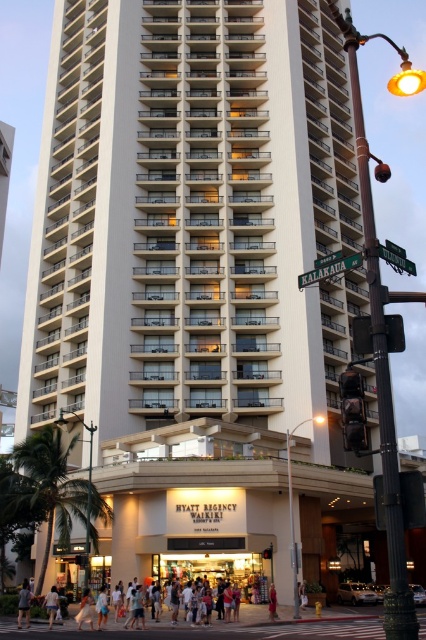
Which is in front, point (49, 612) or point (273, 605)?

Point (49, 612) is in front.

Can you confirm if light blue denim shorts at lower center is shorter than red fabric dress at lower center?

In fact, light blue denim shorts at lower center may be taller than red fabric dress at lower center.

The height and width of the screenshot is (640, 426). What are the coordinates of `light blue denim shorts at lower center` in the screenshot? It's located at (51, 604).

Between light blue denim shorts at lower left and light blue denim shorts at lower center, which one has more height?

Standing taller between the two is light blue denim shorts at lower left.

Who is higher up, light blue denim shorts at lower left or light blue denim shorts at lower center?

light blue denim shorts at lower center is above.

Who is more distant from viewer, (28, 593) or (48, 612)?

Point (48, 612)

Image resolution: width=426 pixels, height=640 pixels. Find the location of `light blue denim shorts at lower left`. light blue denim shorts at lower left is located at coordinates (23, 604).

In the scene shown: Does light blue denim shorts at lower left appear over red fabric dress at lower center?

No, light blue denim shorts at lower left is not above red fabric dress at lower center.

Is point (20, 616) less distant than point (273, 596)?

Yes, it is.

Find the location of a particular element. The height and width of the screenshot is (640, 426). light blue denim shorts at lower left is located at coordinates (23, 604).